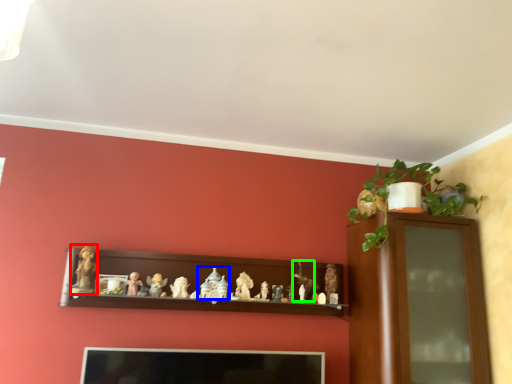
Question: Considering the real-world distances, which object is farthest from toy (highlighted by a red box)? toy (highlighted by a blue box) or toy (highlighted by a green box)?

Choices:
 (A) toy
 (B) toy

Answer: (B)